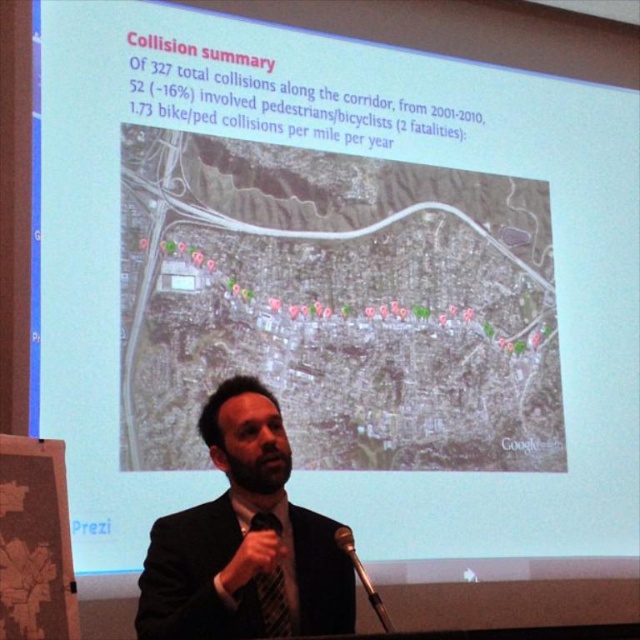
What are the coordinates of `black satin tie at lower center` in the screenshot? It's located at (273, 602).

Based on the photo, is black satin tie at lower center further to the viewer compared to metallic silver microphone at lower center?

That is True.

Is point (272, 609) positioned in front of point (346, 528)?

Yes, point (272, 609) is closer to viewer.

What are the coordinates of `black satin tie at lower center` in the screenshot? It's located at (273, 602).

Between black suit at center and black satin tie at lower center, which one appears on the left side from the viewer's perspective?

black suit at center is more to the left.

Who is more distant from viewer, (218, 464) or (285, 636)?

Point (218, 464)

Identify the location of black suit at center. The width and height of the screenshot is (640, 640). (243, 538).

Between point (248, 480) and point (339, 541), which one is positioned behind?

The point (248, 480) is more distant.

From the picture: Which of these two, black suit at center or metallic silver microphone at lower center, stands shorter?

metallic silver microphone at lower center

Does point (339, 570) lie behind point (362, 573)?

That is True.

Where is `black suit at center`? The height and width of the screenshot is (640, 640). black suit at center is located at coordinates (243, 538).